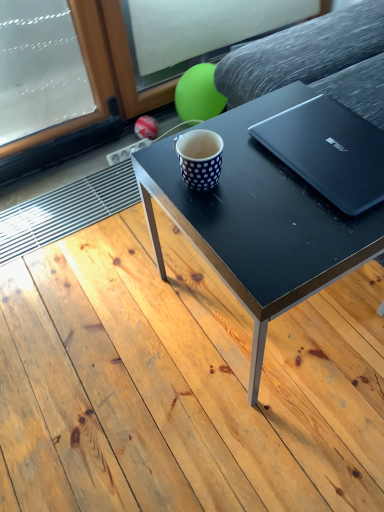
Find the location of a particular element. This screenshot has width=384, height=512. vacant area on the back side of white dotted mug at center is located at coordinates (215, 132).